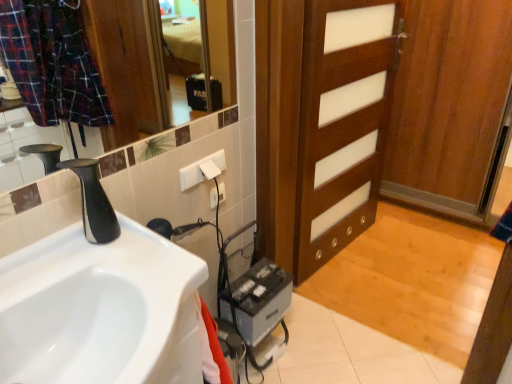
Locate an element on the screen. vacant region above gray metallic battery at lower center (from a real-world perspective) is located at coordinates (254, 280).